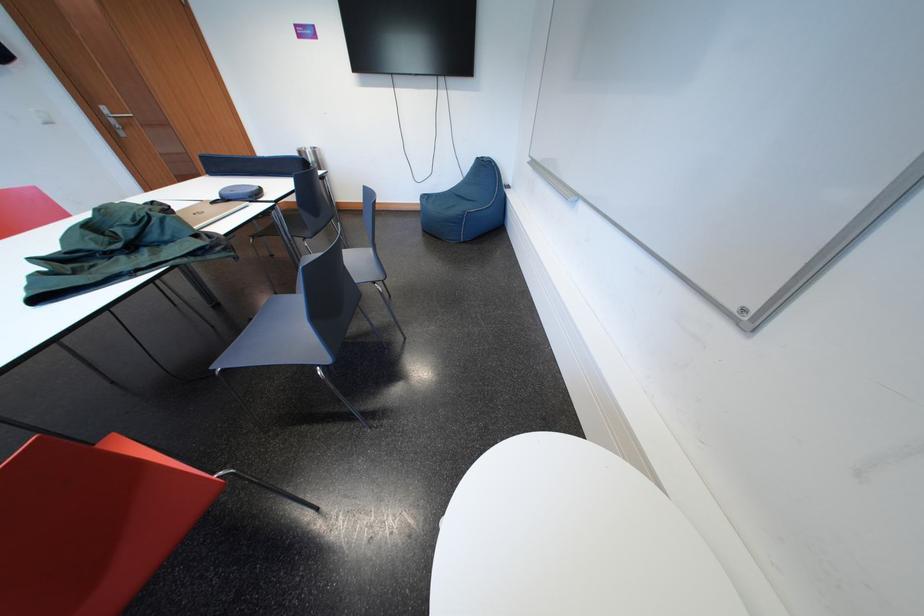
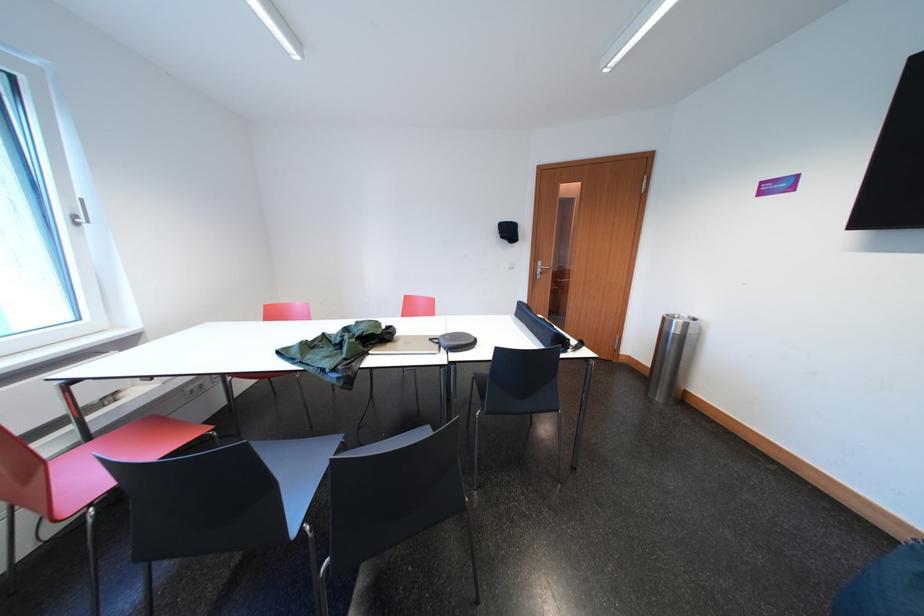
Where in the second image is the point corresponding to (x=301, y=191) from the first image?

(499, 361)